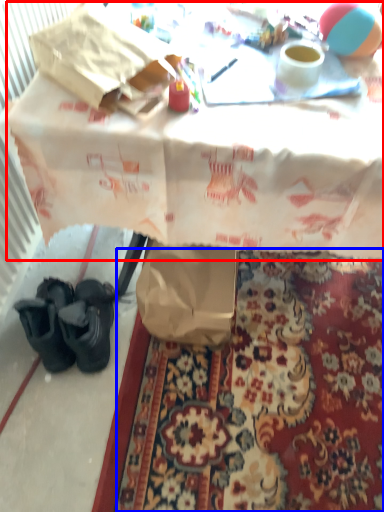
Question: Which object is closer to the camera taking this photo, table (highlighted by a red box) or mat (highlighted by a blue box)?

Choices:
 (A) table
 (B) mat

Answer: (A)